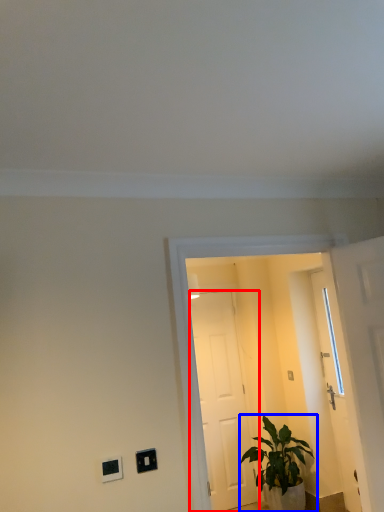
Question: Which point is closer to the camera, door (highlighted by a red box) or houseplant (highlighted by a blue box)?

Choices:
 (A) door
 (B) houseplant

Answer: (B)